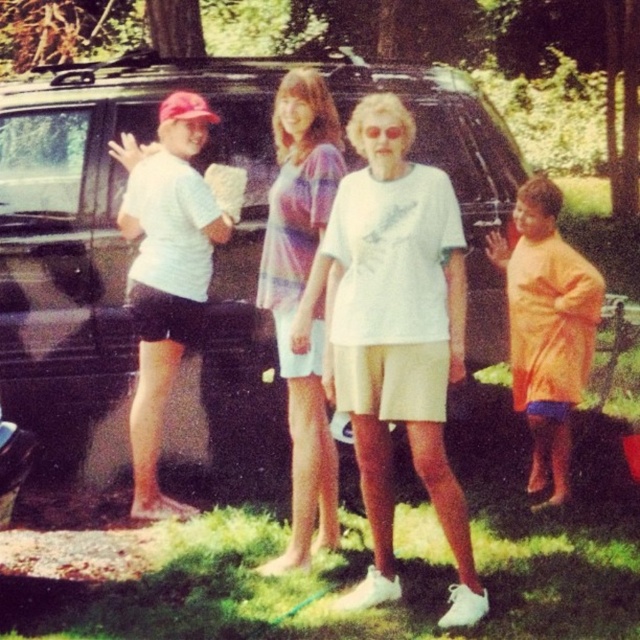
Who is more forward, (413, 125) or (586, 298)?

Point (586, 298)

Between white matte t-shirt at center and orange cotton shirt at right, which one appears on the left side from the viewer's perspective?

white matte t-shirt at center

Is point (408, 326) farther from viewer compared to point (518, 362)?

No, it is in front of (518, 362).

At what (x,y) coordinates should I click in order to perform the action: click on white matte t-shirt at center. Please return your answer as a coordinate pair (x, y). This screenshot has width=640, height=640. Looking at the image, I should click on (396, 336).

Which is above, matte black minivan at center or white matte t-shirt at center?

matte black minivan at center is above.

Identify the location of matte black minivan at center. The image size is (640, 640). (128, 266).

What are the coordinates of `matte black minivan at center` in the screenshot? It's located at (128, 266).

Does point (220, 125) come in front of point (332, 531)?

That is False.

Between matte black minivan at center and striped cotton shirt at center, which one appears on the left side from the viewer's perspective?

matte black minivan at center

Which is behind, point (106, 339) or point (307, 96)?

Point (106, 339)

Find the location of `matte black minivan at center`. matte black minivan at center is located at coordinates (128, 266).